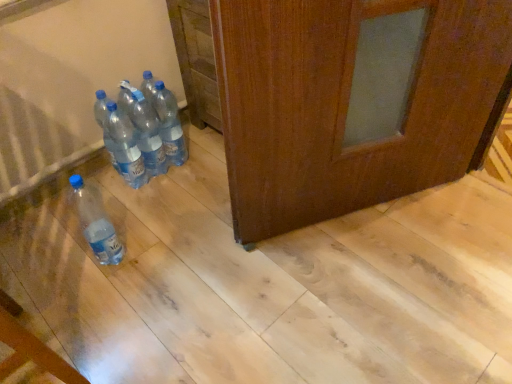
At what (x,y) coordinates should I click in order to perform the action: click on free spot to the right of transparent plastic bottles at center, which ranks as the 3th bottle in left-to-right order. Please return your answer as a coordinate pair (x, y). Looking at the image, I should click on (197, 173).